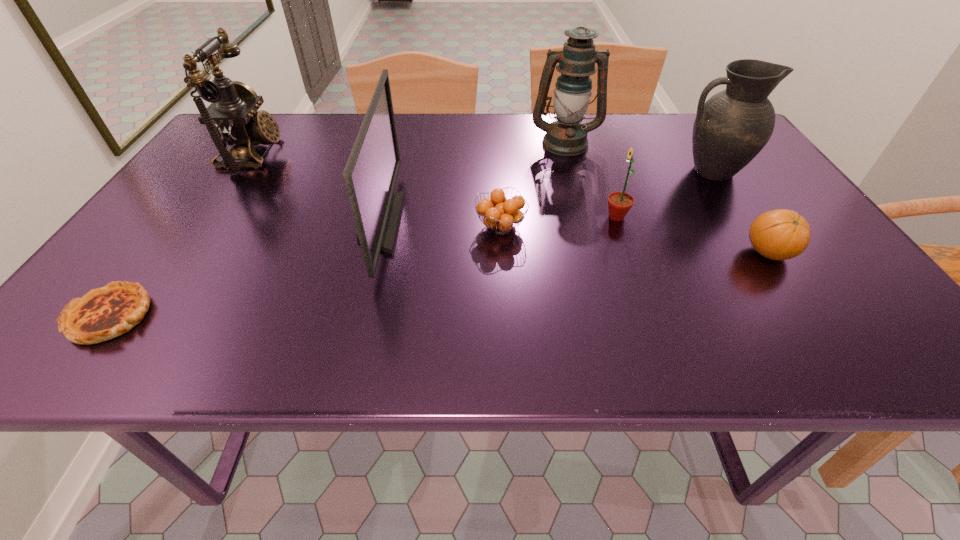
Where is `oil lamp`? Image resolution: width=960 pixels, height=540 pixels. oil lamp is located at coordinates (576, 62).

Image resolution: width=960 pixels, height=540 pixels. Find the location of `telephone`. telephone is located at coordinates (232, 118).

At what (x,y) coordinates should I click in order to perform the action: click on pitcher. Please return your answer as a coordinate pair (x, y). Looking at the image, I should click on (732, 127).

Where is `the third object from left to right`? the third object from left to right is located at coordinates (370, 174).

Where is `the fourth shortest object`? This screenshot has width=960, height=540. the fourth shortest object is located at coordinates (619, 203).

Identify the location of the taller orange fruit. (781, 234).

Locate an element on the screen. the third shortest object is located at coordinates (781, 234).

Locate an element on the screen. The height and width of the screenshot is (540, 960). the left orange fruit is located at coordinates (500, 213).

At what (x,y) coordinates should I click in order to perform the action: click on the fourth object from left to right. Please return your answer as a coordinate pair (x, y). Looking at the image, I should click on (500, 213).

At what (x,y) coordinates should I click in order to perform the action: click on the shortest object. Please return your answer as a coordinate pair (x, y). Looking at the image, I should click on coord(104,313).